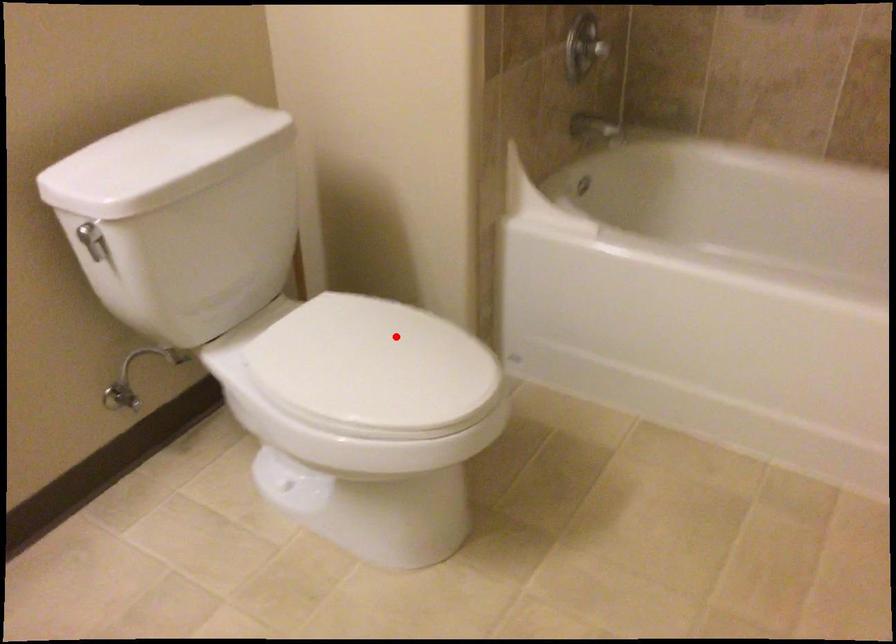
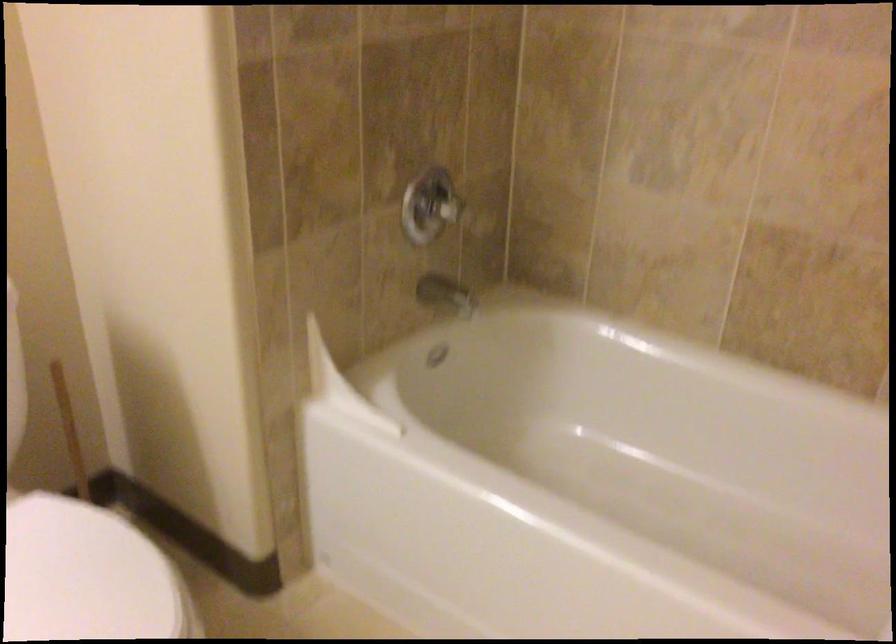
Locate, in the second image, the point that corresponds to the highlighted location in the first image.

(88, 576)